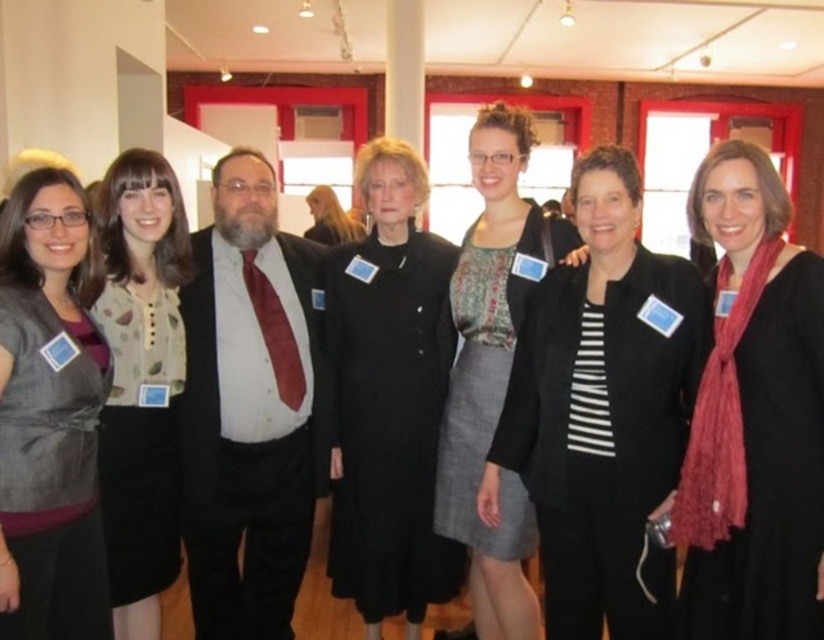
Between point (598, 456) and point (59, 611), which one is positioned in front?

Point (598, 456) is in front.

Does black striped blazer at center appear on the left side of matte gray cardigan at left?

Incorrect, black striped blazer at center is not on the left side of matte gray cardigan at left.

Does point (694, 369) lie in front of point (54, 516)?

No, it is not.

This screenshot has height=640, width=824. What are the coordinates of `black striped blazer at center` in the screenshot? It's located at (602, 410).

Does matte white shirt at center appear on the left side of printed fabric dress at center?

Correct, you'll find matte white shirt at center to the left of printed fabric dress at center.

Can you confirm if matte white shirt at center is bigger than printed fabric dress at center?

No.

Does point (195, 291) come farther from viewer compared to point (488, 328)?

Yes, it is.

I want to click on matte white shirt at center, so 249,408.

Can you confirm if matte gray cardigan at left is bigger than printed fabric dress at center?

No.

Is matte gray cardigan at left below printed fabric dress at center?

Yes.

Image resolution: width=824 pixels, height=640 pixels. Identify the location of matte gray cardigan at left. (48, 419).

At what (x,y) coordinates should I click in order to perform the action: click on matte gray cardigan at left. Please return your answer as a coordinate pair (x, y). Looking at the image, I should click on (48, 419).